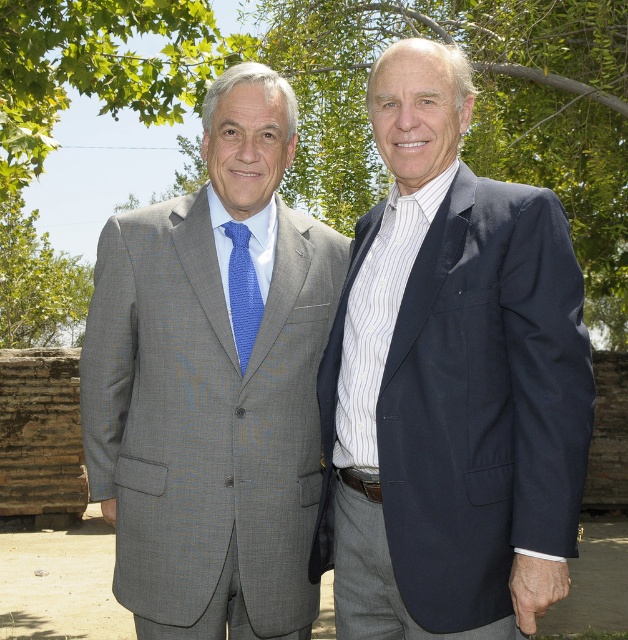
You are a photographer standing at a certain distance from the two men in the image. You want to capture a closeup shot of the gray textured suit at center without moving closer. Is the current distance sufficient for a clear closeup?

The gray textured suit at center is 9.89 feet away from the viewer. A standard camera lens can achieve a clear closeup from this distance, so yes, the current distance is sufficient.